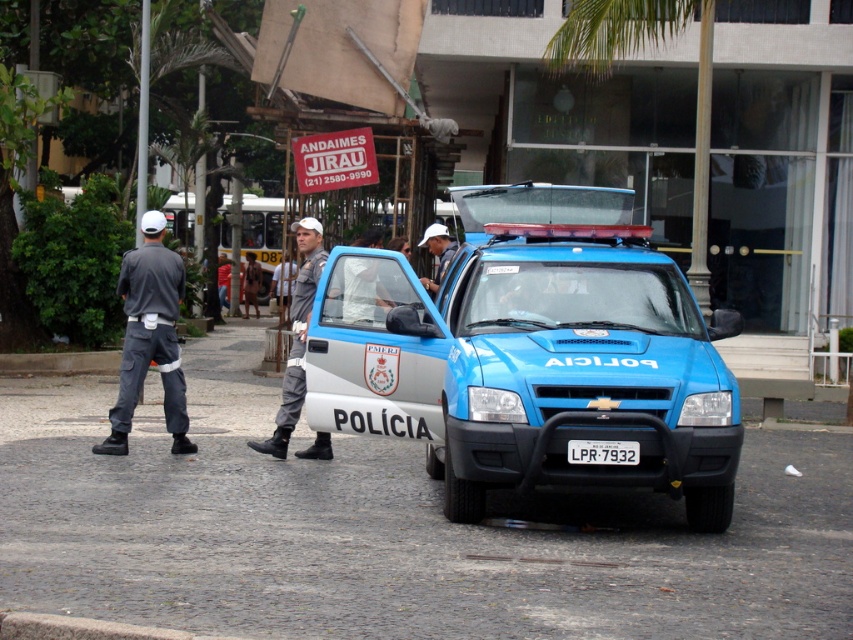
Looking at this image, you are a pedestrian on the street and see the dark gray uniform at left and the gray uniform pants at center. Which one is closer to you?

The dark gray uniform at left is closer to you because it is positioned over the gray uniform pants at center.

You are a pedestrian standing on the sidewalk and see the blue metallic police car at center and the white plastic license plate at center. Which one is higher from the ground?

The blue metallic police car at center is above the white plastic license plate at center, so the blue metallic police car at center is higher from the ground.